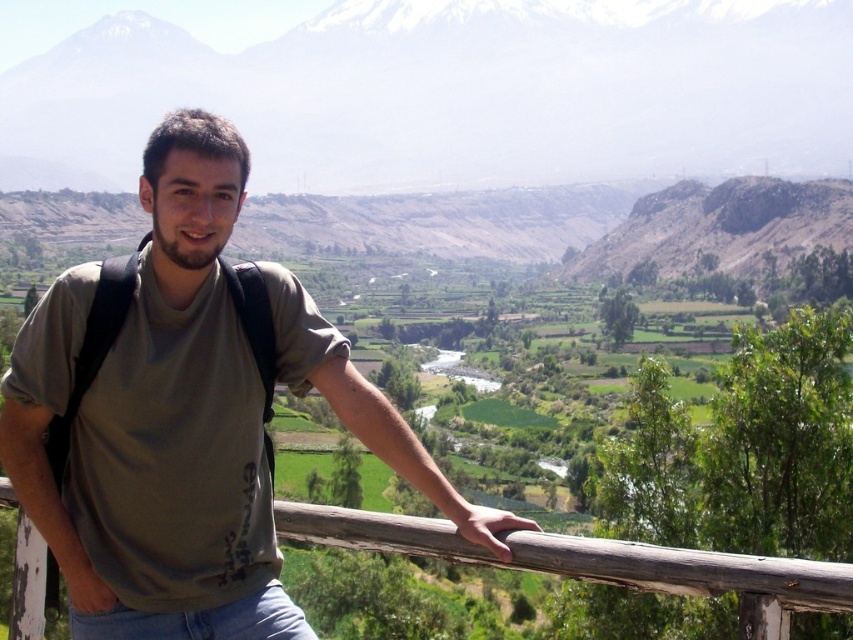
Question: Among these objects, which one is farthest from the camera?

Choices:
 (A) matte green t-shirt at center
 (B) brown wooden rail at center

Answer: (A)

Question: Is matte green t-shirt at center above brown wooden rail at center?

Choices:
 (A) no
 (B) yes

Answer: (B)

Question: Is matte green t-shirt at center positioned in front of brown wooden rail at center?

Choices:
 (A) yes
 (B) no

Answer: (B)

Question: Can you confirm if matte green t-shirt at center is positioned above brown wooden rail at center?

Choices:
 (A) yes
 (B) no

Answer: (A)